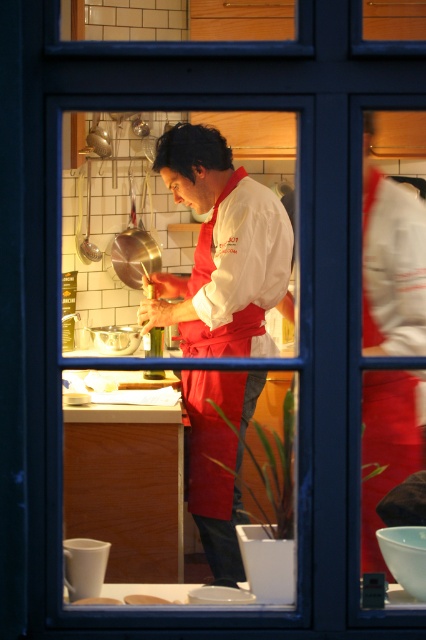
Is white matte chef coat at center in front of white matte bread at center?

No.

Is white matte chef coat at center below white matte bread at center?

No, white matte chef coat at center is not below white matte bread at center.

Is point (222, 337) positioned behind point (141, 602)?

That is True.

This screenshot has height=640, width=426. I want to click on white matte chef coat at center, so click(x=221, y=250).